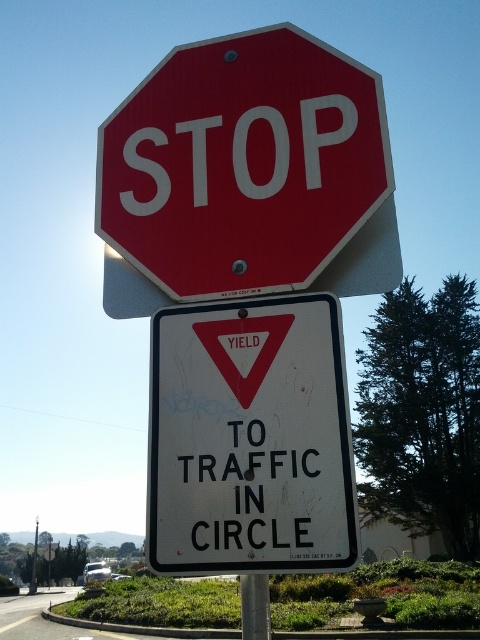
Can you confirm if white matte yield sign at center is bigger than metallic pole at center?

No, white matte yield sign at center is not bigger than metallic pole at center.

Can you confirm if white matte yield sign at center is shorter than metallic pole at center?

Yes.

Where is `white matte yield sign at center`? This screenshot has height=640, width=480. white matte yield sign at center is located at coordinates (250, 438).

Is point (314, 246) more distant than point (36, 529)?

That is False.

Is smooth red stop sign at center in front of metallic pole at center?

Yes, it is in front of metallic pole at center.

Is point (319, 218) positioned behind point (34, 582)?

That is False.

The image size is (480, 640). Find the location of `smooth red stop sign at center`. smooth red stop sign at center is located at coordinates (247, 176).

Does smooth red stop sign at center lie in front of white matte yield sign at center?

No, it is not.

Does smooth red stop sign at center appear on the left side of white matte yield sign at center?

Yes, smooth red stop sign at center is to the left of white matte yield sign at center.

Does point (389, 152) come closer to viewer compared to point (260, 301)?

No, (389, 152) is behind (260, 301).

You are a GUI agent. You are given a task and a screenshot of the screen. Output one action in this format:
    pyautogui.click(x=<x>, y=<y>)
    Task: Click on the smooth red stop sign at center
    The width and height of the screenshot is (480, 640).
    Given the screenshot: What is the action you would take?
    pyautogui.click(x=247, y=176)